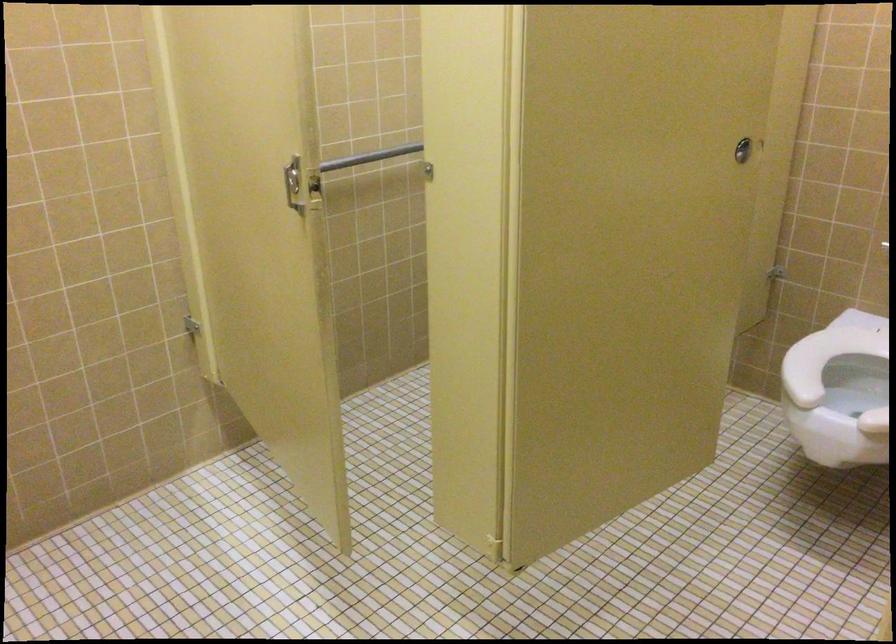
Where would you lift the white toilet seat? Please return your answer as a coordinate pair (x, y).

(836, 362)